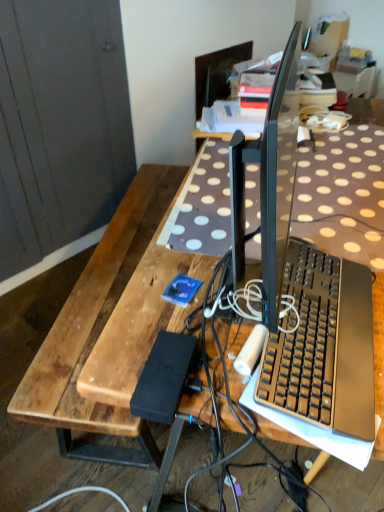
Question: From the image's perspective, is black plastic keyboard at center located beneath brown wooden bench at left?

Choices:
 (A) yes
 (B) no

Answer: (B)

Question: Is the surface of black plastic keyboard at center in direct contact with brown wooden bench at left?

Choices:
 (A) no
 (B) yes

Answer: (A)

Question: Considering the relative sizes of black plastic keyboard at center and brown wooden bench at left in the image provided, is black plastic keyboard at center taller than brown wooden bench at left?

Choices:
 (A) yes
 (B) no

Answer: (B)

Question: Is black plastic keyboard at center positioned with its back to brown wooden bench at left?

Choices:
 (A) yes
 (B) no

Answer: (B)

Question: Would you say black plastic keyboard at center is outside brown wooden bench at left?

Choices:
 (A) no
 (B) yes

Answer: (B)

Question: Would you say black plastic keyboard at center contains brown wooden bench at left?

Choices:
 (A) yes
 (B) no

Answer: (B)

Question: Is brown wooden bench at left in front of black plastic keyboard at center?

Choices:
 (A) no
 (B) yes

Answer: (A)

Question: From a real-world perspective, is brown wooden bench at left on top of black plastic keyboard at center?

Choices:
 (A) yes
 (B) no

Answer: (B)

Question: Is brown wooden bench at left next to black plastic keyboard at center and touching it?

Choices:
 (A) no
 (B) yes

Answer: (A)

Question: Would you say black plastic keyboard at center is part of brown wooden bench at left's contents?

Choices:
 (A) no
 (B) yes

Answer: (A)

Question: Can you confirm if brown wooden bench at left is positioned to the left of black plastic keyboard at center?

Choices:
 (A) no
 (B) yes

Answer: (B)

Question: Is brown wooden bench at left positioned with its back to black plastic keyboard at center?

Choices:
 (A) no
 (B) yes

Answer: (A)

Question: Which is correct: brown wooden bench at left is inside black plastic keyboard at center, or outside of it?

Choices:
 (A) outside
 (B) inside

Answer: (A)